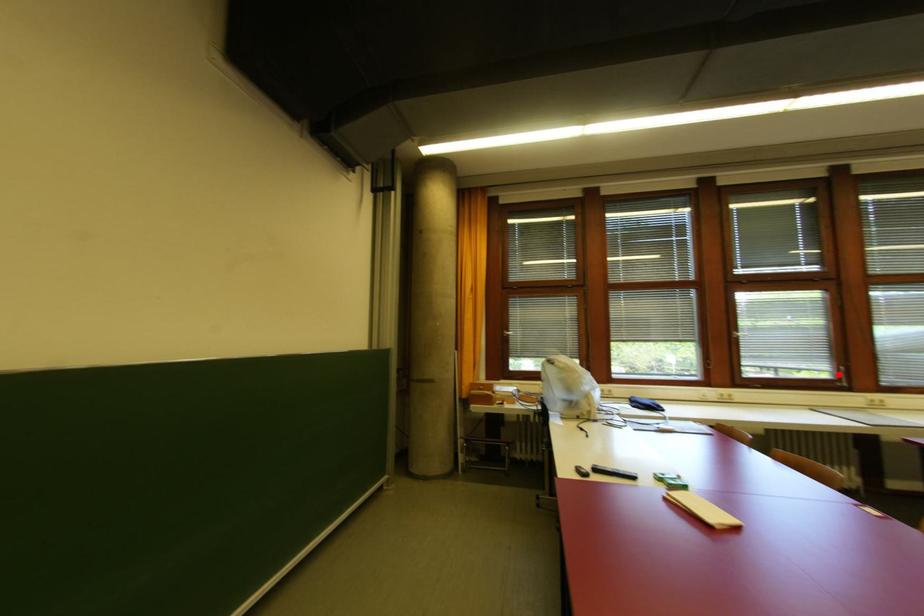
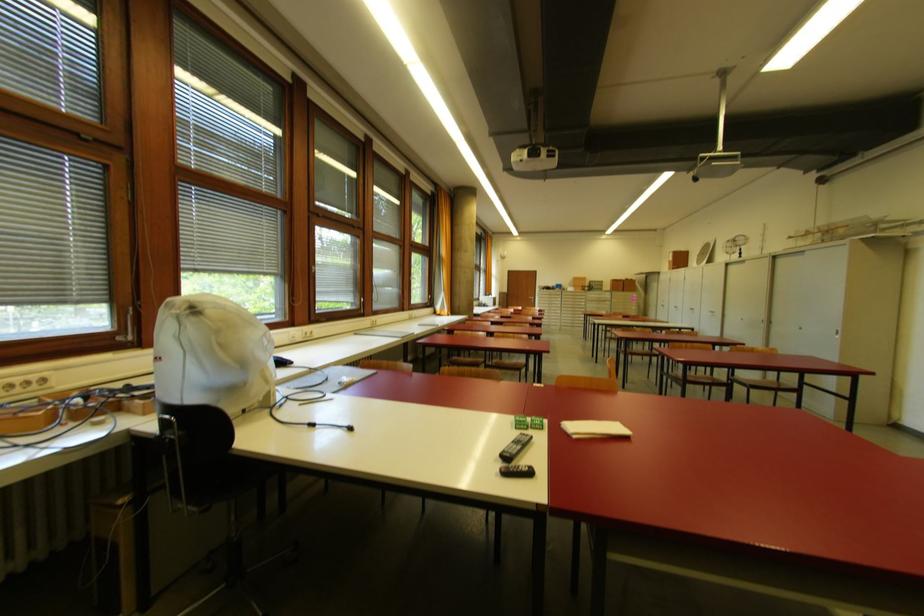
Question: I am providing you with two images of the same scene from different viewpoints. A red point is shown in image1. For the corresponding object point in image2, is it positioned nearer or farther from the camera?

Choices:
 (A) Nearer
 (B) Farther

Answer: (B)